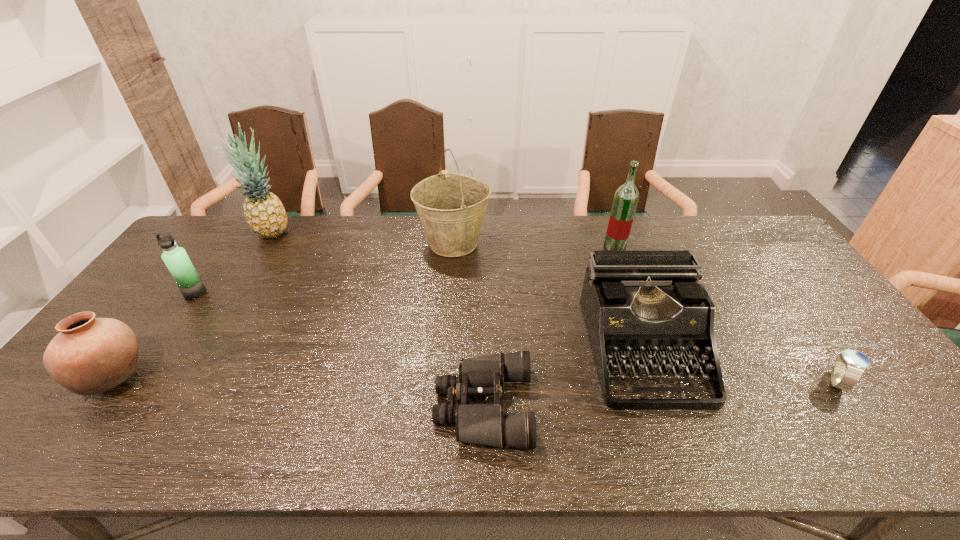
Where is `the sixth object from right to left`? The width and height of the screenshot is (960, 540). the sixth object from right to left is located at coordinates (264, 212).

The image size is (960, 540). Find the location of `wine bucket`. wine bucket is located at coordinates (451, 207).

Where is `liquor`? Image resolution: width=960 pixels, height=540 pixels. liquor is located at coordinates (626, 197).

Image resolution: width=960 pixels, height=540 pixels. Identify the location of thermos bottle. (176, 259).

Identify the location of typewriter. The image size is (960, 540). (637, 305).

What are the coordinates of `pottery` in the screenshot? It's located at (90, 355).

At what (x,y) coordinates should I click in order to perform the action: click on watch. Please return your answer as a coordinate pair (x, y). This screenshot has width=960, height=540. Looking at the image, I should click on click(848, 367).

Where is `binoculars`? This screenshot has height=540, width=960. binoculars is located at coordinates (485, 424).

You are a GUI agent. You are given a task and a screenshot of the screen. Output one action in this format:
    pyautogui.click(x=<x>, y=<y>)
    Task: Click on the free point located 0.260m on the front of the pineapple
    This screenshot has width=960, height=540.
    Given the screenshot: What is the action you would take?
    pyautogui.click(x=231, y=296)

Find the location of a particular element. This screenshot has height=540, width=960. vacant region located 0.330m on the right of the wine bucket is located at coordinates (587, 243).